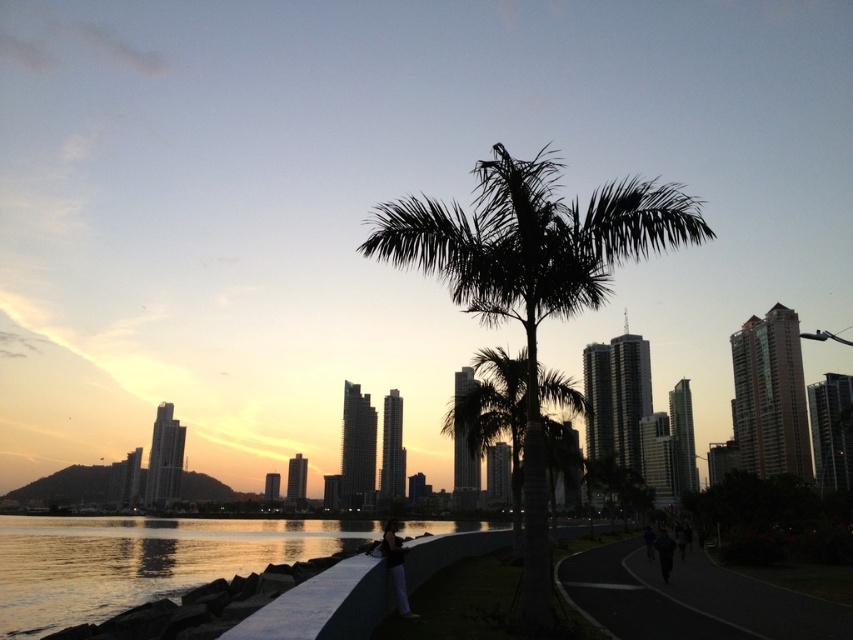
Question: Does black fabric pants at lower center have a smaller size compared to dark fabric person at lower center?

Choices:
 (A) no
 (B) yes

Answer: (A)

Question: Can you confirm if green leafy palm tree at center is positioned to the left of dark fabric person at lower center?

Choices:
 (A) yes
 (B) no

Answer: (A)

Question: Does silhouette leafy palm at center appear under black fabric pants at lower center?

Choices:
 (A) yes
 (B) no

Answer: (B)

Question: Which object is positioned closest to the dark fabric person at lower center?

Choices:
 (A) black fabric pants at lower center
 (B) green leafy palm tree at center
 (C) black asphalt road at lower right

Answer: (C)

Question: Estimate the real-world distances between objects in this image. Which object is farther from the black asphalt road at lower right?

Choices:
 (A) black fabric pants at lower center
 (B) green leafy palm tree at center
 (C) smooth concrete wall at lower center
 (D) dark fabric person at lower center

Answer: (C)

Question: Among these objects, which one is nearest to the camera?

Choices:
 (A) black fabric pants at lower center
 (B) dark fabric person at lower center
 (C) green leafy palm tree at center
 (D) silhouette leafy palm at center

Answer: (D)